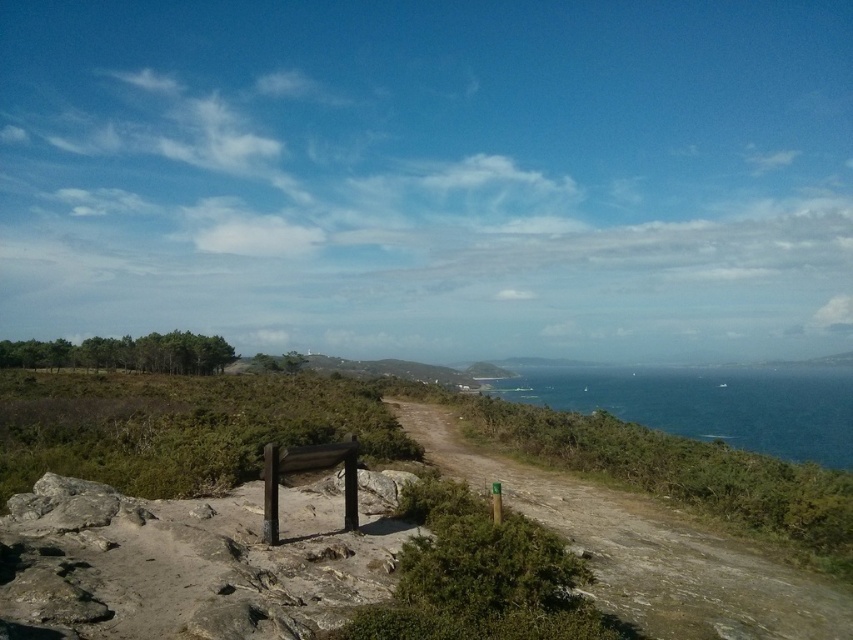
What do you see at coordinates (646, 548) in the screenshot?
I see `dirt path at center` at bounding box center [646, 548].

Can you confirm if dirt path at center is bigger than blue glossy water at right?

No.

Identify the location of dirt path at center. This screenshot has height=640, width=853. (646, 548).